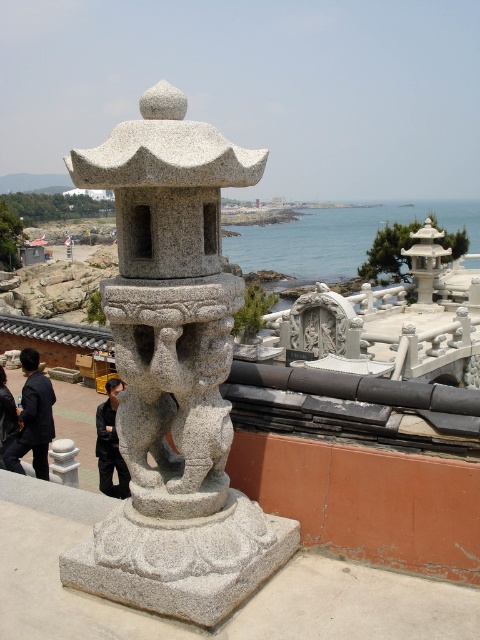
Question: Among these objects, which one is farthest from the camera?

Choices:
 (A) gray stone lantern at center
 (B) dark blue suit at lower left
 (C) blue water at center

Answer: (C)

Question: Is black fabric jacket at lower left to the right of gray stone lantern at center from the viewer's perspective?

Choices:
 (A) yes
 (B) no

Answer: (B)

Question: Which point is farther to the camera?

Choices:
 (A) dark blue suit at lower left
 (B) granite statue at center
 (C) blue water at center

Answer: (C)

Question: Is black matte jacket at center bigger than gray stone lantern at center?

Choices:
 (A) yes
 (B) no

Answer: (A)

Question: Which object is positioned farthest from the black matte jacket at center?

Choices:
 (A) gray stone lantern at center
 (B) black fabric jacket at lower left
 (C) granite statue at center

Answer: (C)

Question: Is black matte jacket at center bigger than gray stone lantern at center?

Choices:
 (A) yes
 (B) no

Answer: (A)